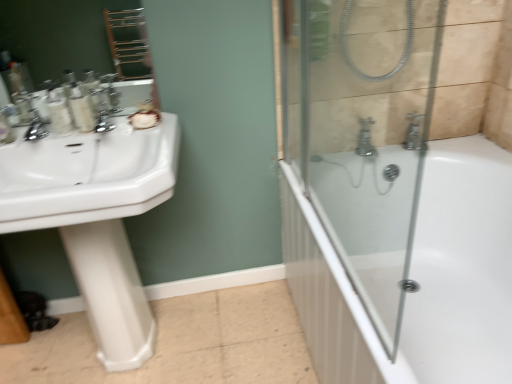
Where is `free spot below white glossy sink at left (from a real-world perspective)`? Image resolution: width=512 pixels, height=384 pixels. free spot below white glossy sink at left (from a real-world perspective) is located at coordinates (119, 370).